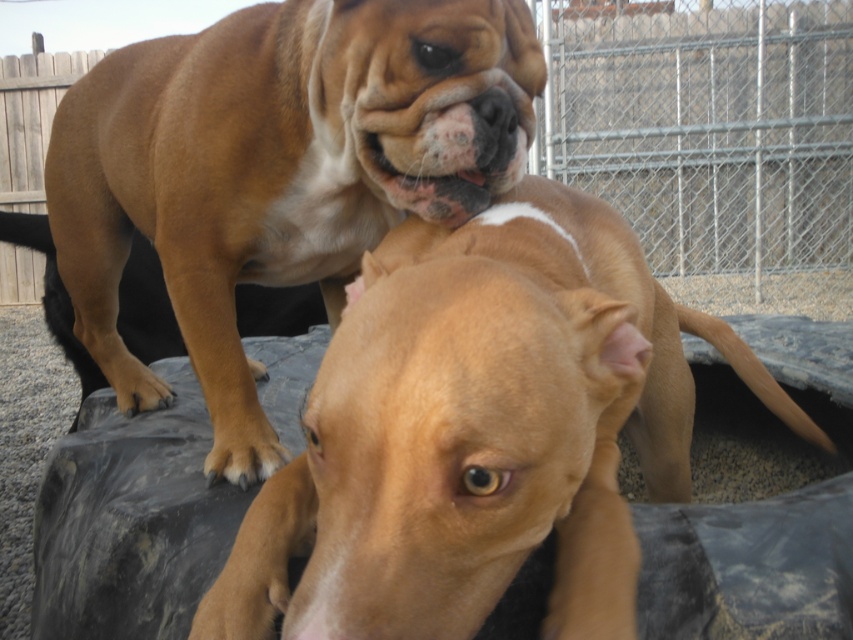
What do you see at coordinates (480, 432) in the screenshot? I see `smooth tan dog at center` at bounding box center [480, 432].

Does smooth tan dog at center have a larger size compared to brown matte dog at center?

No.

The image size is (853, 640). In order to click on smooth tan dog at center in this screenshot , I will do `click(480, 432)`.